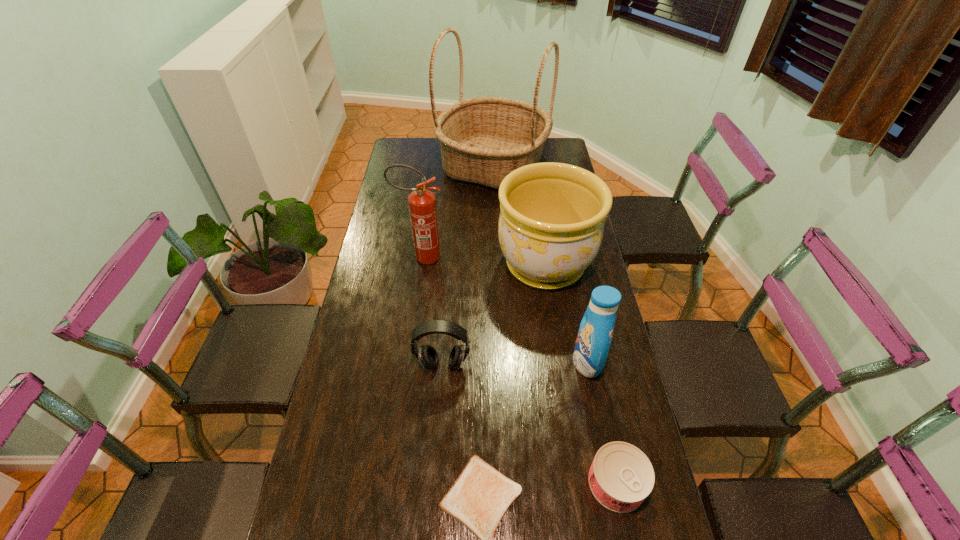
This screenshot has width=960, height=540. What are the coordinates of `free space located on the front-facing side of the detergent` in the screenshot? It's located at (550, 362).

Where is `vacant space located 0.220m on the front-facing side of the detergent`? This screenshot has width=960, height=540. vacant space located 0.220m on the front-facing side of the detergent is located at coordinates (499, 362).

Identify the location of vacant space situated 0.060m on the front-facing side of the detergent. This screenshot has height=540, width=960. (553, 362).

What are the coordinates of `vacant region located 0.070m on the ear cups of the earphone` in the screenshot? It's located at (440, 397).

Find the location of a particular element. This screenshot has width=960, height=540. vacant space situated on the back of the can is located at coordinates (588, 341).

At what (x,y) coordinates should I click in order to perform the action: click on object present at the far edge. Please return your answer as a coordinate pair (x, y). This screenshot has height=540, width=960. Looking at the image, I should click on (482, 139).

Locate an element on the screen. object that is at the left edge is located at coordinates (422, 204).

Where is `basket at the right edge`? basket at the right edge is located at coordinates (482, 139).

Find the location of a particular element. flowerpot located at the right edge is located at coordinates (552, 215).

At what (x,y) coordinates should I click in order to perform the action: click on detergent located in the right edge section of the desktop. Please return your answer as a coordinate pair (x, y). The height and width of the screenshot is (540, 960). Looking at the image, I should click on pyautogui.click(x=595, y=333).